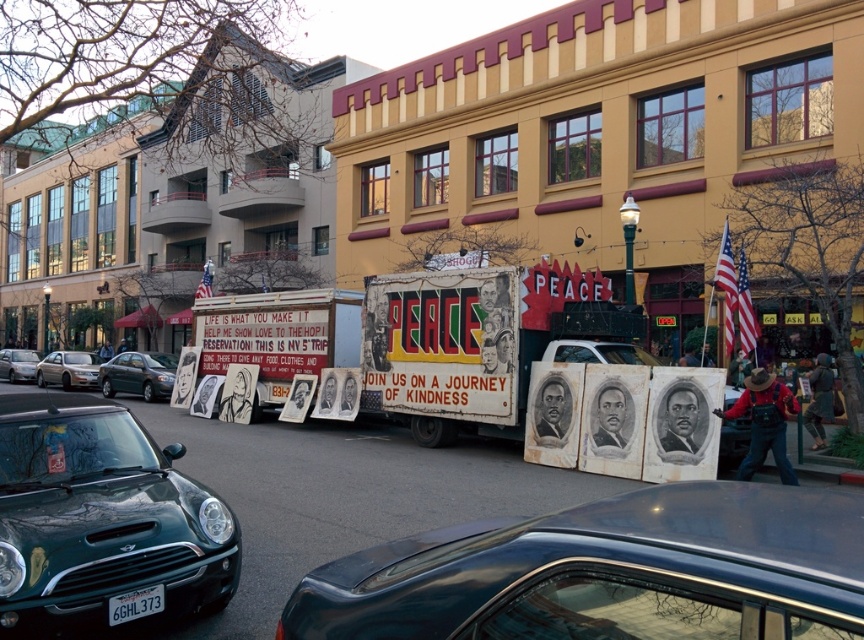
Looking at this image, does metallic silver sedan at center-left appear under metallic green car at left?

Actually, metallic silver sedan at center-left is above metallic green car at left.

Between metallic silver sedan at center-left and metallic green car at left, which one is positioned higher?

Positioned higher is metallic silver sedan at center-left.

Is point (96, 378) farther from camera compared to point (20, 364)?

No, (96, 378) is closer to viewer.

Find the location of `metallic silver sedan at center-left`. metallic silver sedan at center-left is located at coordinates (68, 369).

Is metallic silver sedan at center-left above white plastic license plate at lower left?

Yes.

Is the position of metallic silver sedan at center-left less distant than that of white plastic license plate at lower left?

No.

Describe the element at coordinates (68, 369) in the screenshot. This screenshot has height=640, width=864. I see `metallic silver sedan at center-left` at that location.

Identify the location of metallic silver sedan at center-left. Image resolution: width=864 pixels, height=640 pixels. (68, 369).

Can you confirm if white plastic license plate at lower left is positioned to the left of metallic green car at left?

Incorrect, white plastic license plate at lower left is not on the left side of metallic green car at left.

Describe the element at coordinates (135, 604) in the screenshot. The image size is (864, 640). I see `white plastic license plate at lower left` at that location.

Where is `white plastic license plate at lower left`? The height and width of the screenshot is (640, 864). white plastic license plate at lower left is located at coordinates (135, 604).